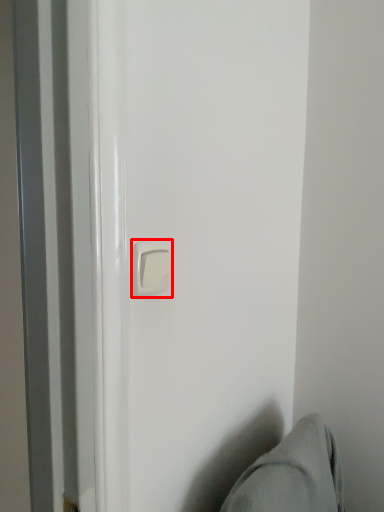
Question: Considering the relative positions of door handle (annotated by the red box) and swivel chair in the image provided, where is door handle (annotated by the red box) located with respect to the staircase?

Choices:
 (A) left
 (B) right

Answer: (A)